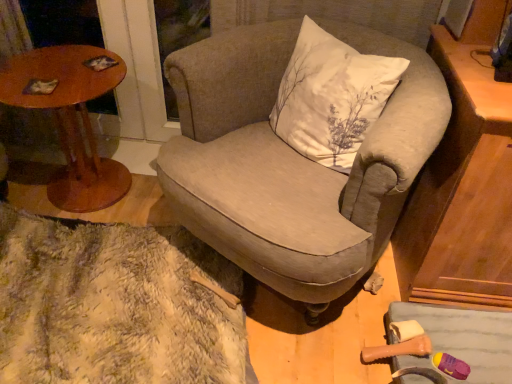
Question: From the image's perspective, is wooden round table at left located above or below textured beige armchair at center?

Choices:
 (A) above
 (B) below

Answer: (A)

Question: Considering the positions of wooden round table at left and textured beige armchair at center in the image, is wooden round table at left bigger or smaller than textured beige armchair at center?

Choices:
 (A) small
 (B) big

Answer: (A)

Question: Estimate the real-world distances between objects in this image. Which object is closer to the textured beige armchair at center?

Choices:
 (A) wooden round table at left
 (B) fuzzy beige rug at lower left
 (C) matte brown cabinet at right
 (D) white cotton pillow at center

Answer: (D)

Question: Considering the real-world distances, which object is farthest from the textured beige armchair at center?

Choices:
 (A) matte brown cabinet at right
 (B) fuzzy beige rug at lower left
 (C) white cotton pillow at center
 (D) wooden round table at left

Answer: (D)